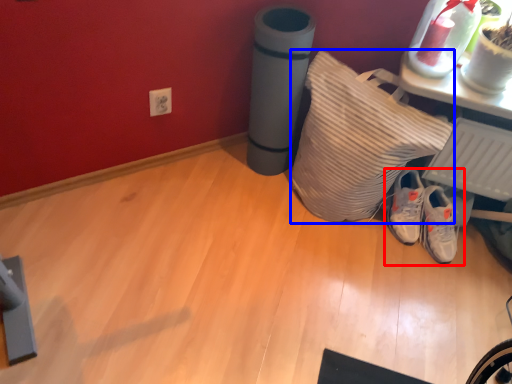
Question: Among these objects, which one is farthest to the camera, footwear (highlighted by a red box) or pillow (highlighted by a blue box)?

Choices:
 (A) footwear
 (B) pillow

Answer: (A)